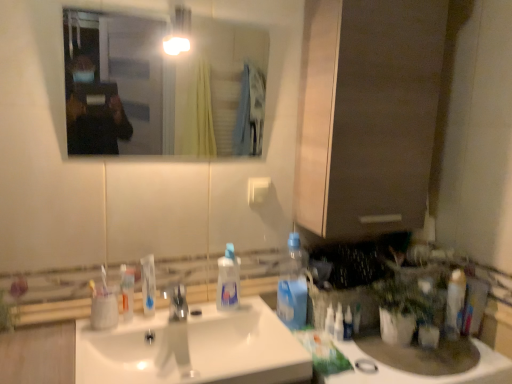
Where is `vacant space to the right of transparent plastic spray bottle at center, which is the 1th cleaning product from left to right`? vacant space to the right of transparent plastic spray bottle at center, which is the 1th cleaning product from left to right is located at coordinates (259, 316).